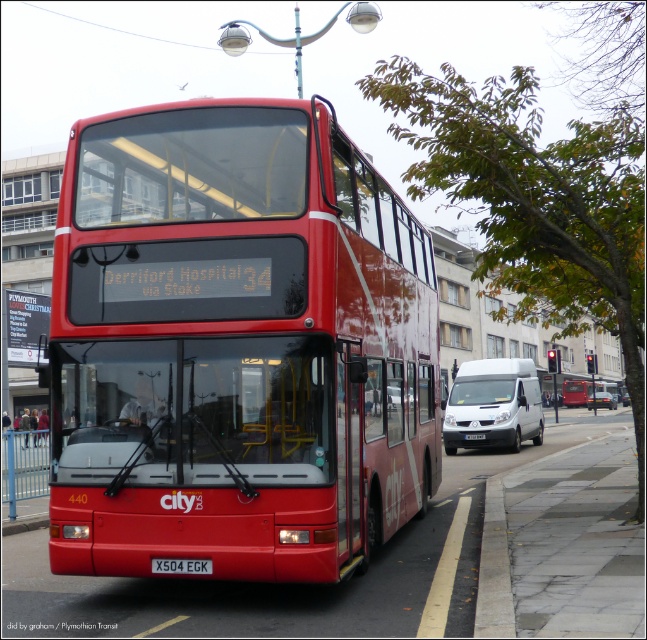
You are a delivery person who needs to attach a 1.2 meter tall package to the top of the black plastic license plate at center and the matte white van at center. Can you determine which object will allow the package to fit without exceeding its height?

The black plastic license plate at center is not as tall as matte white van at center, so the package can be attached to the matte white van at center since it is taller and can accommodate the 1.2 meter tall package.

What are the coordinates of the black plastic license plate at center?

The black plastic license plate at center is located at point [181,566].